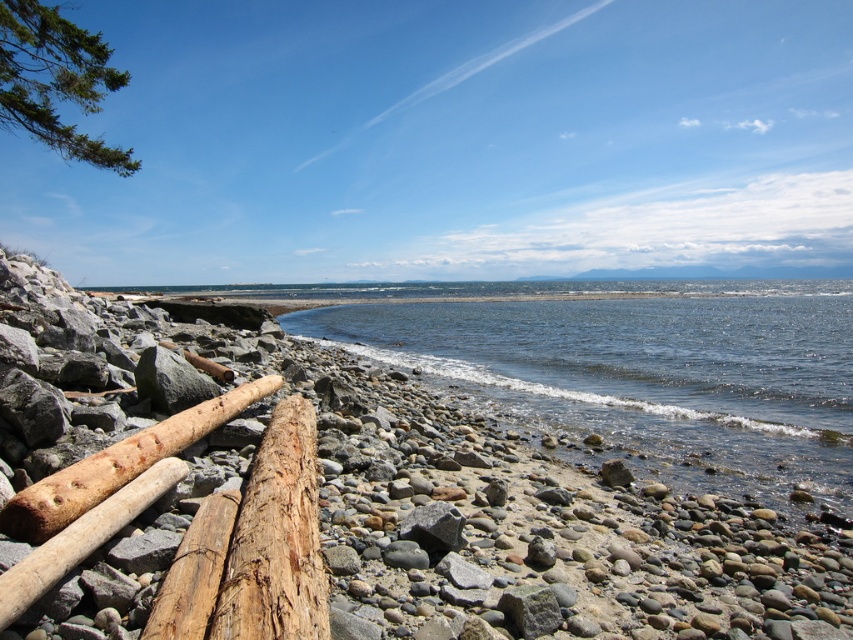
You are standing at the shoreline looking out towards the horizon. There are two points marked in the image. Which point, point (341, 582) or point (141, 444), is closer to your current position?

Point (341, 582) is closer to the camera than point (141, 444), so it is closer to your current position.